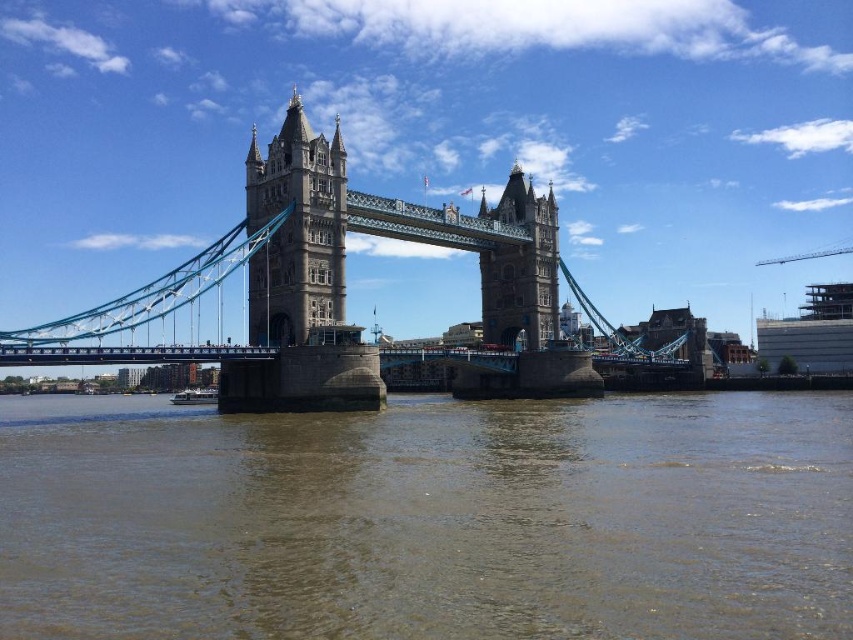
You are an engineer assessing the stability of the blue metallic suspension bridge at center. The brown sedimentary water at center is part of the river below. Since the river is narrower than the bridge, could this affect the bridge structure?

The brown sedimentary water at center has a width less than the blue metallic suspension bridge at center. This means the bridge spans across the river, which is narrower than the bridge itself. This configuration is typical for suspension bridges, where the main span is supported over the water, and the narrower riverbed does not negatively impact the bridge structure as the design accounts for such spans.

You are a tourist standing on the riverbank and want to take a photo of the blue metallic suspension bridge at center and the stone stonework tower at center. Which object will appear closer to you in the photo?

The blue metallic suspension bridge at center will appear closer to you in the photo because it is positioned in front of the stone stonework tower at center.

You are a tourist standing on the walkway of Tower Bridge and want to take a photo of both the brown sedimentary water at center and the stone stonework tower at center. Since you want to include both in the frame, which object should you position closer to the bottom of your camera viewfinder to ensure both are fully visible?

To include both the brown sedimentary water at center and the stone stonework tower at center in the frame, you should position the brown sedimentary water at center closer to the bottom of your camera viewfinder since it has a lesser height compared to the stone stonework tower at center.